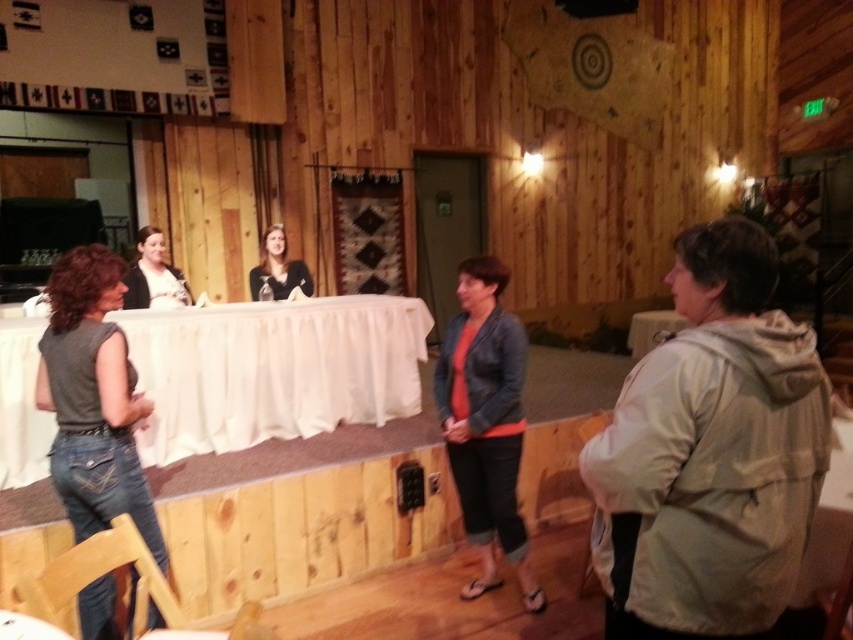
Locate an element on the screen. The image size is (853, 640). matte black jacket at center is located at coordinates (154, 275).

Is matte black jacket at center below matte black shirt at center?

Indeed, matte black jacket at center is positioned under matte black shirt at center.

Find the location of a particular element. matte black jacket at center is located at coordinates (154, 275).

You are a GUI agent. You are given a task and a screenshot of the screen. Output one action in this format:
    pyautogui.click(x=<x>, y=<y>)
    Task: Click on the matte black jacket at center
    
    Given the screenshot: What is the action you would take?
    pyautogui.click(x=154, y=275)

Is denim jeans at left positioned before matte black shirt at center?

Yes.

Does denim jeans at left appear on the right side of matte black shirt at center?

Incorrect, denim jeans at left is not on the right side of matte black shirt at center.

Which is in front, point (115, 394) or point (308, 294)?

Point (115, 394)

Locate an element on the screen. denim jeans at left is located at coordinates (93, 397).

Is white satin tablecloth at center to the left of orange fabric jacket at center from the viewer's perspective?

Indeed, white satin tablecloth at center is positioned on the left side of orange fabric jacket at center.

Who is positioned more to the right, white satin tablecloth at center or orange fabric jacket at center?

Positioned to the right is orange fabric jacket at center.

Is point (132, 330) in front of point (477, 458)?

No.

The image size is (853, 640). Identify the location of white satin tablecloth at center. (271, 369).